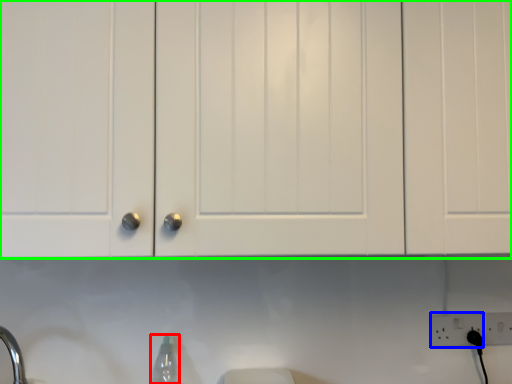
Question: Based on their relative distances, which object is farther from bottle (highlighted by a red box)? Choose from electric outlet (highlighted by a blue box) and cabinetry (highlighted by a green box).

Choices:
 (A) electric outlet
 (B) cabinetry

Answer: (A)